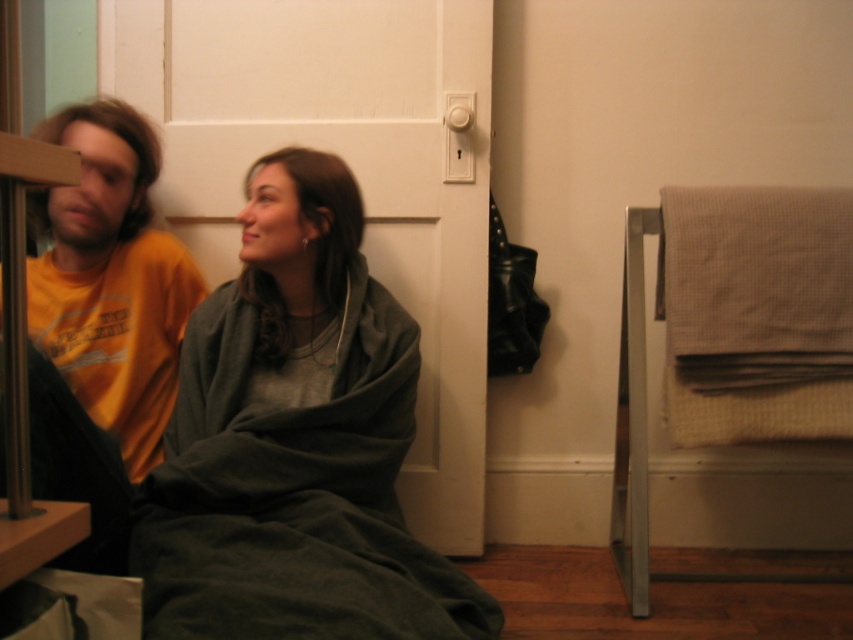
Question: Where is beige textured towel at right located in relation to orange t-shirt at left in the image?

Choices:
 (A) right
 (B) left

Answer: (A)

Question: Which point is farther to the camera?

Choices:
 (A) dark green fleece blanket at center
 (B) beige textured towel at right

Answer: (B)

Question: Does beige textured towel at right have a lesser width compared to orange t-shirt at left?

Choices:
 (A) no
 (B) yes

Answer: (A)

Question: Which object appears farthest from the camera in this image?

Choices:
 (A) orange t-shirt at left
 (B) beige textured towel at right

Answer: (B)

Question: Does dark green fleece blanket at center appear on the left side of beige textured towel at right?

Choices:
 (A) no
 (B) yes

Answer: (B)

Question: Which point is closer to the camera?

Choices:
 (A) (135, 246)
 (B) (372, 444)

Answer: (B)